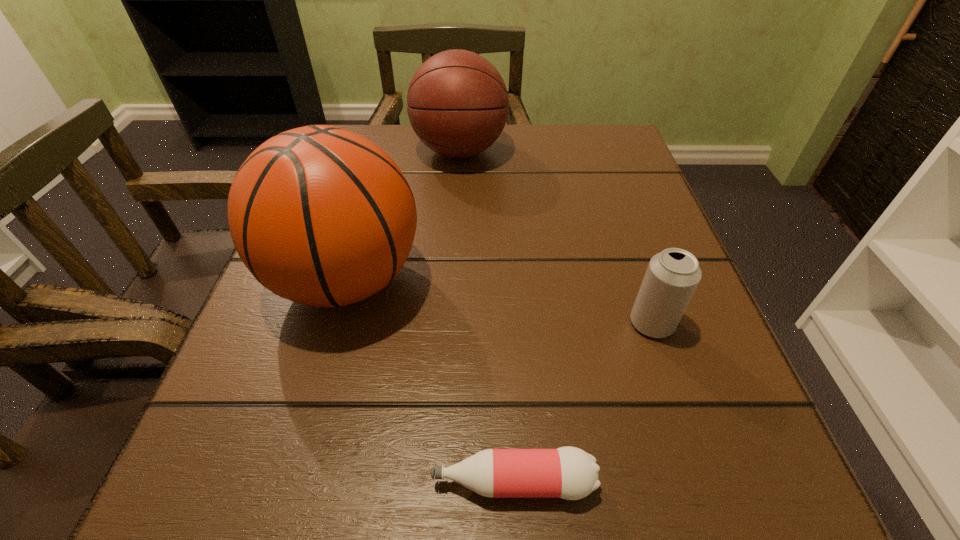
Find the location of a particular element. The image size is (960, 540). vacant space located 0.120m on the back of the rightmost object is located at coordinates (628, 252).

Where is `vacant position located with the cap open on the shortest object`? This screenshot has height=540, width=960. vacant position located with the cap open on the shortest object is located at coordinates (196, 482).

The width and height of the screenshot is (960, 540). Identify the location of vacant position located 0.110m with the cap open on the shortest object. point(332,482).

Where is `free spot located with the cap open on the shortest object`? This screenshot has height=540, width=960. free spot located with the cap open on the shortest object is located at coordinates (296, 482).

At what (x,y) coordinates should I click in order to perform the action: click on object that is positioned at the far edge. Please return your answer as a coordinate pair (x, y). This screenshot has height=540, width=960. Looking at the image, I should click on (457, 103).

What are the coordinates of `object at the near edge` in the screenshot? It's located at (570, 473).

The width and height of the screenshot is (960, 540). I want to click on object at the left edge, so click(320, 215).

The image size is (960, 540). What are the coordinates of `object that is positioned at the right edge` in the screenshot? It's located at (672, 276).

This screenshot has width=960, height=540. Find the location of `free region at the near edge of the desktop`. free region at the near edge of the desktop is located at coordinates (568, 516).

The width and height of the screenshot is (960, 540). I want to click on free space at the left edge, so click(269, 406).